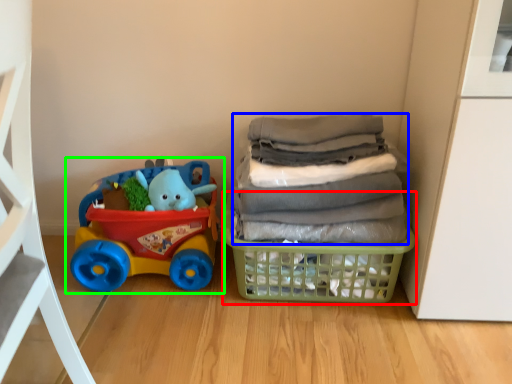
Question: Which is nearer to the basket (highlighted by a red box)? laundry (highlighted by a blue box) or toy (highlighted by a green box).

Choices:
 (A) laundry
 (B) toy

Answer: (A)